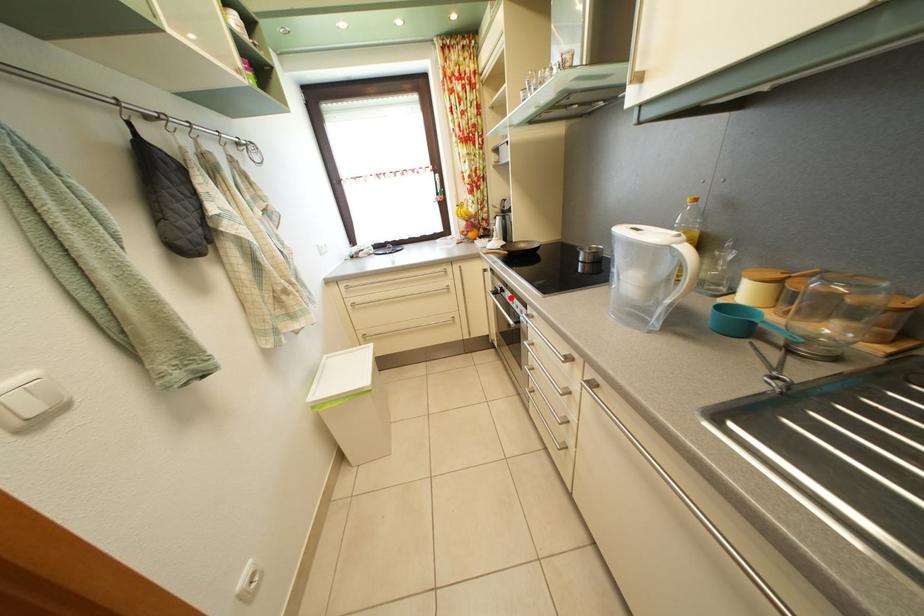
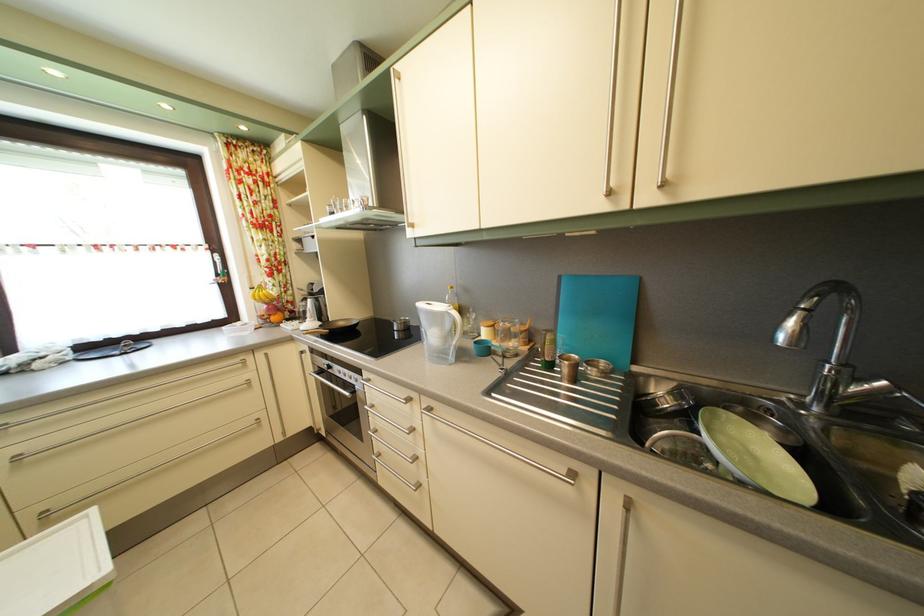
Locate, in the second image, the point that corresponds to the highlighted location in the first image.

(337, 374)